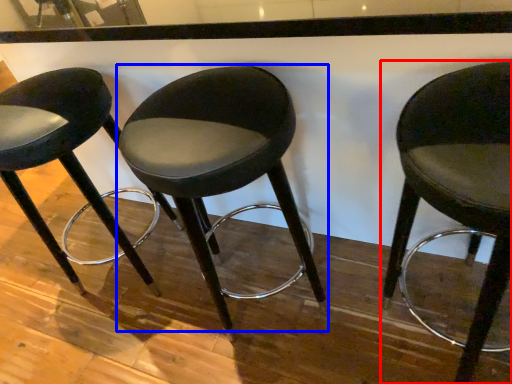
Question: Which object is further to the camera taking this photo, chair (highlighted by a red box) or chair (highlighted by a blue box)?

Choices:
 (A) chair
 (B) chair

Answer: (B)